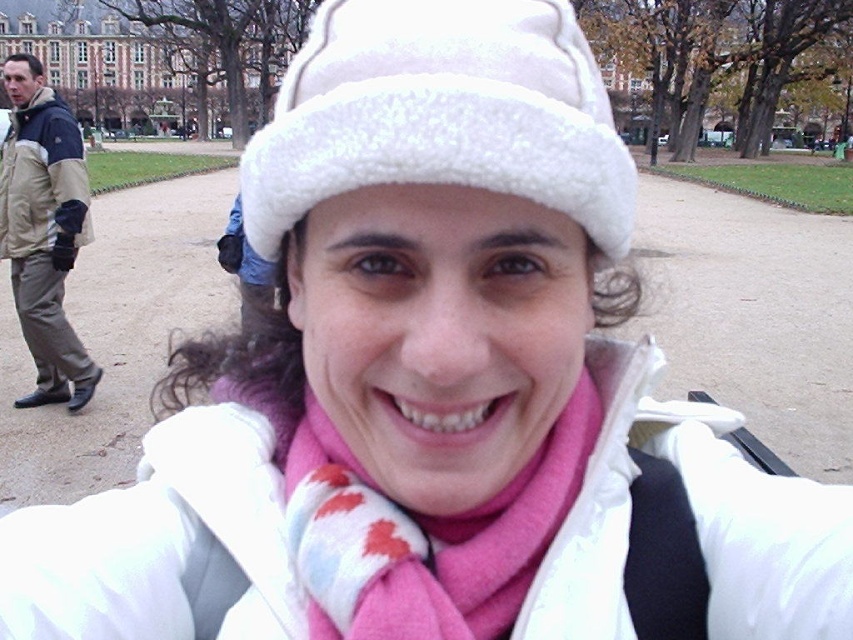
Does white fuzzy hat at center appear over khaki cotton pants at left?

Actually, white fuzzy hat at center is below khaki cotton pants at left.

Is point (477, 51) in front of point (28, 298)?

Yes, it is in front of point (28, 298).

You are a GUI agent. You are given a task and a screenshot of the screen. Output one action in this format:
    pyautogui.click(x=<x>, y=<y>)
    Task: Click on the white fuzzy hat at center
    This screenshot has width=853, height=640.
    Given the screenshot: What is the action you would take?
    pyautogui.click(x=442, y=115)

Can you confirm if white fuzzy hat at center is thinner than khaki nylon jacket at left?

Yes.

Is point (554, 3) behind point (30, 248)?

That is False.

This screenshot has height=640, width=853. What are the coordinates of `white fuzzy hat at center` in the screenshot? It's located at (442, 115).

The width and height of the screenshot is (853, 640). Find the location of `white fuzzy hat at center`. white fuzzy hat at center is located at coordinates (442, 115).

Based on the photo, can you confirm if khaki cotton pants at left is bigger than khaki nylon jacket at left?

Yes.

The image size is (853, 640). Find the location of `khaki cotton pants at left`. khaki cotton pants at left is located at coordinates (44, 230).

Where is `khaki cotton pants at left`? This screenshot has width=853, height=640. khaki cotton pants at left is located at coordinates (44, 230).